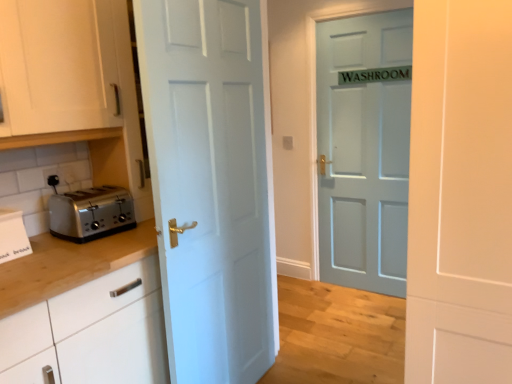
Question: Which direction should I rotate to look at light blue matte door at center, the third door viewed from the front, — up or down?

Choices:
 (A) up
 (B) down

Answer: (A)

Question: From a real-world perspective, is white glossy door at center, marked as the second door in a back-to-front arrangement, physically above white cardboard box at left?

Choices:
 (A) no
 (B) yes

Answer: (A)

Question: Is white cardboard box at left a part of white glossy door at center, which is the second door from front to back?

Choices:
 (A) no
 (B) yes

Answer: (A)

Question: Is white glossy door at center, marked as the second door in a back-to-front arrangement, in front of white cardboard box at left?

Choices:
 (A) yes
 (B) no

Answer: (A)

Question: Is white glossy door at center, marked as the second door in a back-to-front arrangement, behind white cardboard box at left?

Choices:
 (A) no
 (B) yes

Answer: (A)

Question: Is white glossy door at center, which is the second door from front to back, to the left of white cardboard box at left from the viewer's perspective?

Choices:
 (A) no
 (B) yes

Answer: (A)

Question: From a real-world perspective, is white glossy door at center, which is the second door from front to back, physically below white cardboard box at left?

Choices:
 (A) no
 (B) yes

Answer: (B)

Question: Does white matte cabinet at upper left have a greater height compared to white glossy door at center, marked as the second door in a back-to-front arrangement?

Choices:
 (A) yes
 (B) no

Answer: (B)

Question: Would you say white matte cabinet at upper left is a long distance from white glossy door at center, which is the second door from front to back?

Choices:
 (A) yes
 (B) no

Answer: (B)

Question: Is white matte cabinet at upper left turned away from white glossy door at center, marked as the second door in a back-to-front arrangement?

Choices:
 (A) yes
 (B) no

Answer: (B)

Question: Is white matte cabinet at upper left to the right of white glossy door at center, marked as the second door in a back-to-front arrangement, from the viewer's perspective?

Choices:
 (A) no
 (B) yes

Answer: (A)

Question: From a real-world perspective, is white matte cabinet at upper left beneath white glossy door at center, which is the second door from front to back?

Choices:
 (A) yes
 (B) no

Answer: (B)

Question: Considering the relative positions of white matte cabinet at upper left and white glossy door at center, marked as the second door in a back-to-front arrangement, in the image provided, is white matte cabinet at upper left to the left of white glossy door at center, marked as the second door in a back-to-front arrangement, from the viewer's perspective?

Choices:
 (A) no
 (B) yes

Answer: (B)

Question: Is white matte door at center, the 3th door in the back-to-front sequence, positioned with its back to satin silver toaster at left?

Choices:
 (A) yes
 (B) no

Answer: (B)